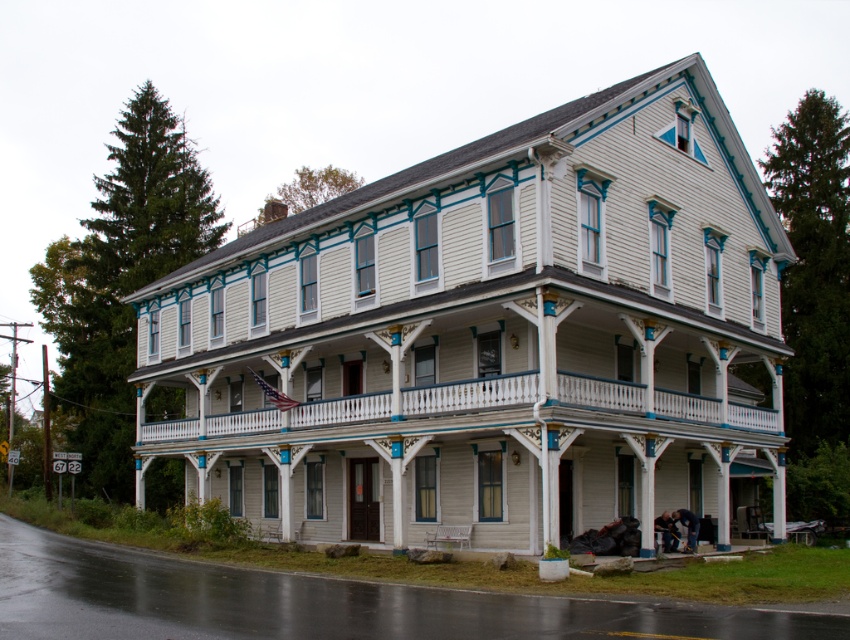
You are a delivery person with a cart that is 5 meters long. You need to navigate through the space between the white wood building at center and the white painted wood porch at center. Can your cart fit through this space?

The distance between the white wood building at center and the white painted wood porch at center is 4.77 meters. Since your cart is 5 meters long, it cannot fit through the space as it is slightly longer than the available distance.

You are standing in front of the white wood building at center and want to enter the white painted wood porch at center. Which direction should you walk to reach the porch?

The white wood building at center is above the white painted wood porch at center, so you should walk downward to reach the porch.

You are a painter hired to paint the white wood building at center and the white painted wood porch at center. You have enough paint to cover 100 square meters. Which object should you paint first to ensure you can finish both without running out of paint?

The white painted wood porch at center is smaller than the white wood building at center, so you should paint the white painted wood porch at center first. This way, if there is any leftover paint, it can be used for the larger building.